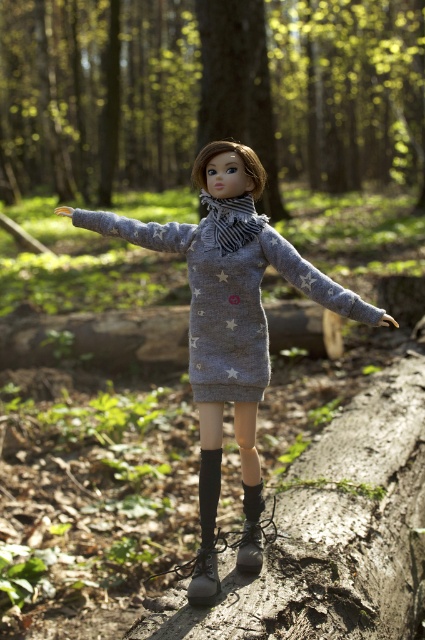
Based on the scene description, can you determine the spatial relationship between the gray knit dress at center and the leather boots at lower center?

The gray knit dress at center is above the leather boots at lower center.